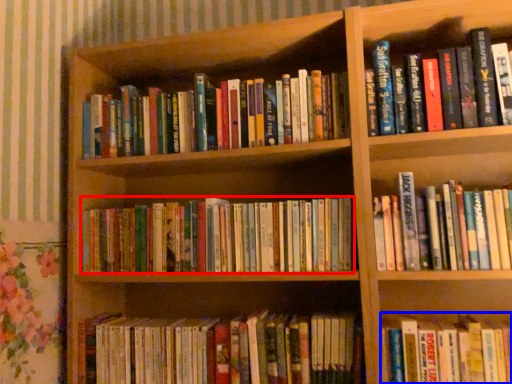
Question: Which of the following is the farthest to the observer, book (highlighted by a red box) or book (highlighted by a blue box)?

Choices:
 (A) book
 (B) book

Answer: (A)